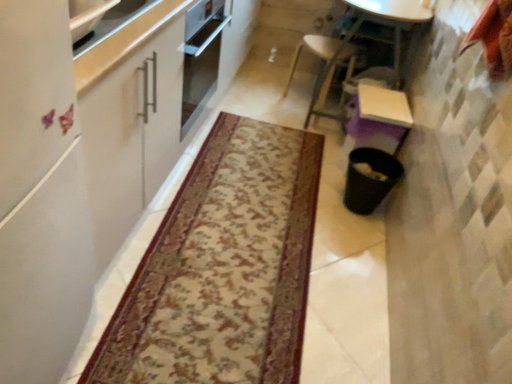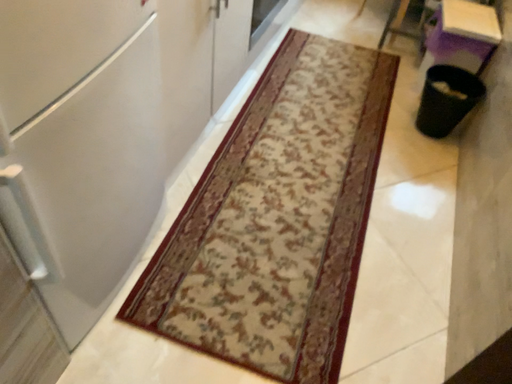
Question: Which way did the camera rotate in the video?

Choices:
 (A) rotated left
 (B) rotated right

Answer: (A)